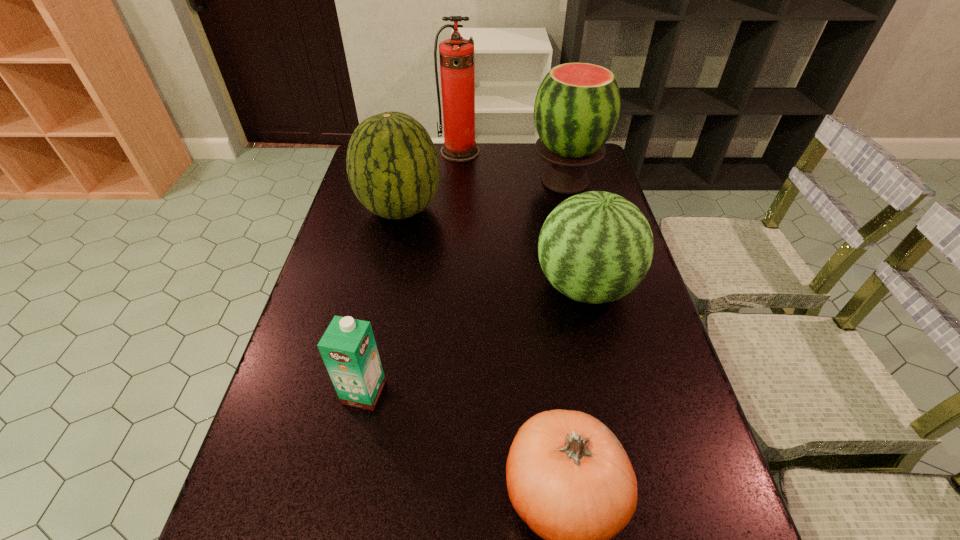
Locate an element on the screen. the tallest object is located at coordinates (456, 55).

Locate an element on the screen. The height and width of the screenshot is (540, 960). the leftmost watermelon is located at coordinates (392, 164).

Identify the location of the nearest watermelon. The image size is (960, 540). (595, 247).

In order to click on carton in this screenshot , I will do `click(348, 348)`.

At what (x,y) coordinates should I click in order to perform the action: click on free space located at the discharge end of the tallest object. Please return your answer as a coordinate pair (x, y). This screenshot has width=960, height=540. Looking at the image, I should click on (458, 186).

Locate an element on the screen. free location located 0.270m on the back of the leftmost watermelon is located at coordinates (414, 147).

Locate an element on the screen. Image resolution: width=960 pixels, height=540 pixels. vacant space situated on the front of the fourth farthest object is located at coordinates (611, 396).

Find the location of a particular element. This screenshot has width=960, height=540. free space located on the right of the carton is located at coordinates (536, 393).

At what (x,y) coordinates should I click in order to perform the action: click on fire extinguisher that is positioned at the far edge. Please return your answer as a coordinate pair (x, y). Looking at the image, I should click on (456, 55).

Locate an element on the screen. The height and width of the screenshot is (540, 960). watermelon at the far edge is located at coordinates (577, 106).